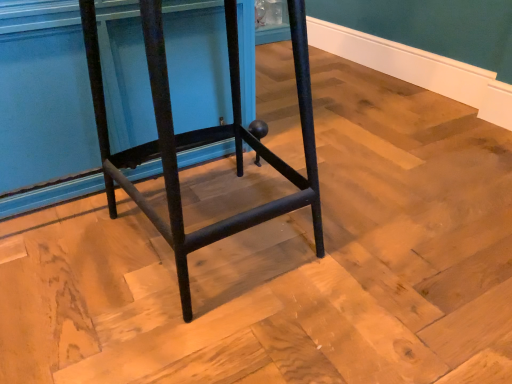
Locate an element on the screen. Image resolution: width=512 pixels, height=384 pixels. vacant space in front of black metal stool at center is located at coordinates [x=208, y=334].